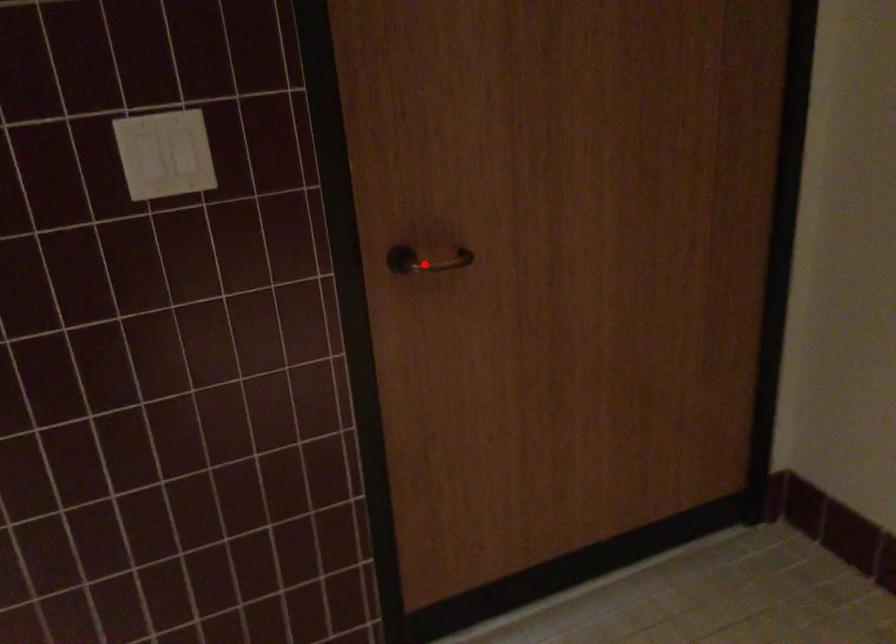
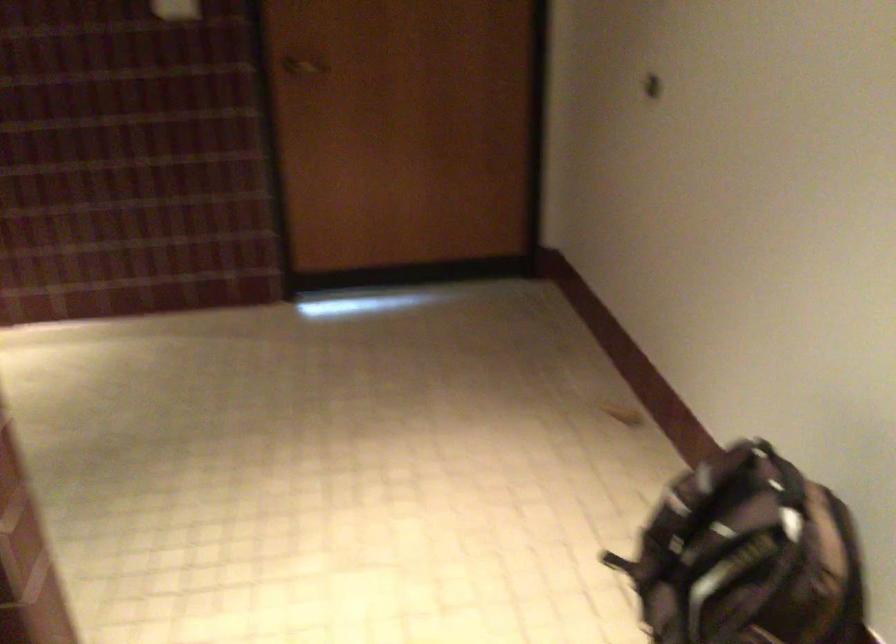
Question: I am providing you with two images of the same scene from different viewpoints. Given a red point in image1, look at the same physical point in image2. Is it:

Choices:
 (A) Closer to the viewpoint
 (B) Farther from the viewpoint

Answer: (B)